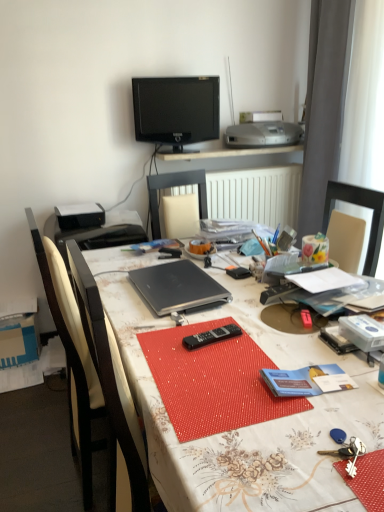
Question: From the image's perspective, is matte black laptop at center located above or below black plastic remote at center?

Choices:
 (A) below
 (B) above

Answer: (A)

Question: Is matte black laptop at center situated inside black plastic remote at center or outside?

Choices:
 (A) inside
 (B) outside

Answer: (B)

Question: Which is farther from the black wood chair at left?

Choices:
 (A) black matte laptop at center
 (B) black glossy television at upper center
 (C) matte black laptop at center
 (D) satin silver printer at upper center
 (E) black plastic remote control at center, the first stationery in the left-to-right sequence

Answer: (D)

Question: Estimate the real-world distances between objects in this image. Which object is farther from the black matte laptop at center?

Choices:
 (A) floral paper towel at upper right, which appears as the 1th stationery when viewed from the right
 (B) black plastic remote at center
 (C) black glossy television at upper center
 (D) matte black laptop at center
 (E) black plastic remote control at center, which is the second stationery from right to left

Answer: (C)